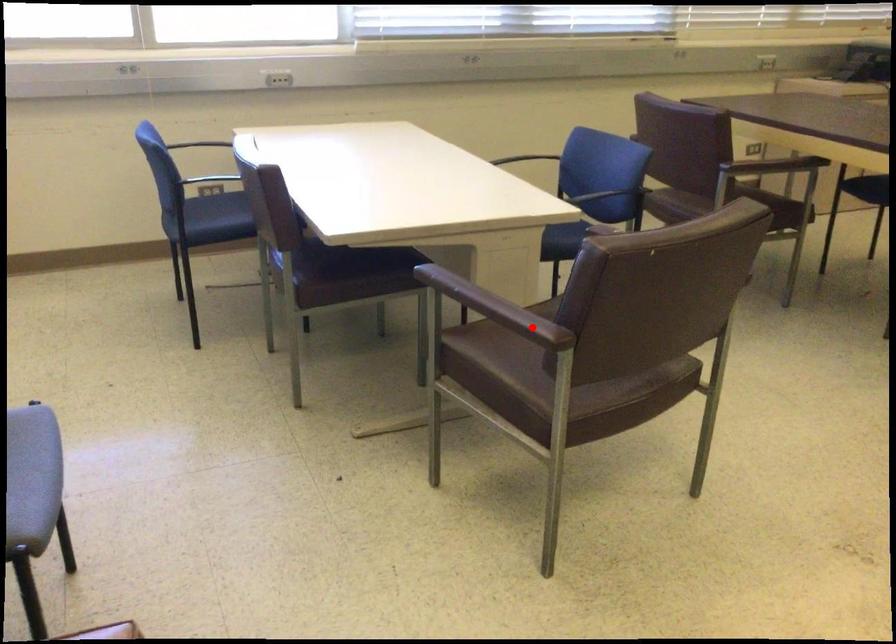
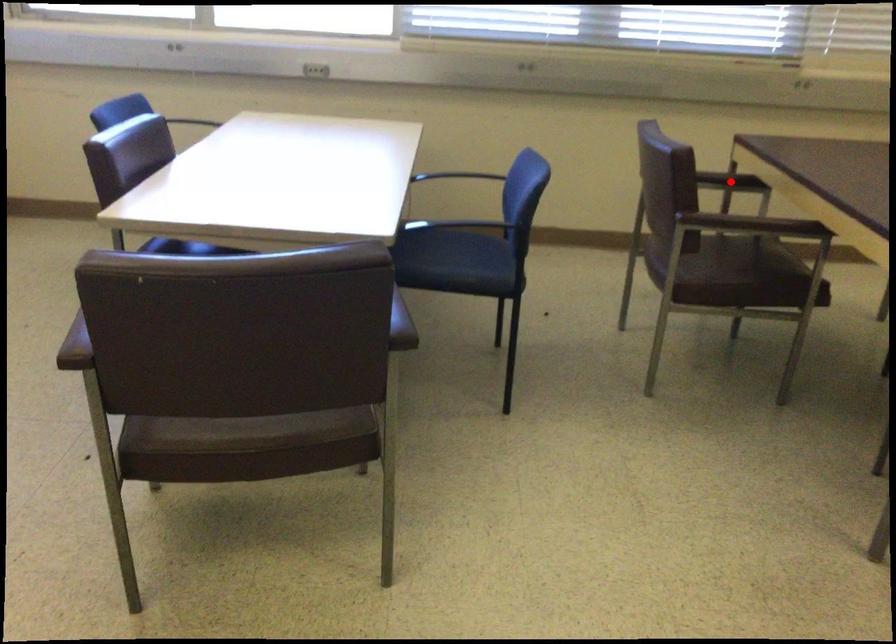
Looking at this image, I am providing you with two images of the same scene from different viewpoints. A red point is marked on the first image and another point is marked on the second image. Are the points marked in image1 and image2 representing the same 3D position?

No